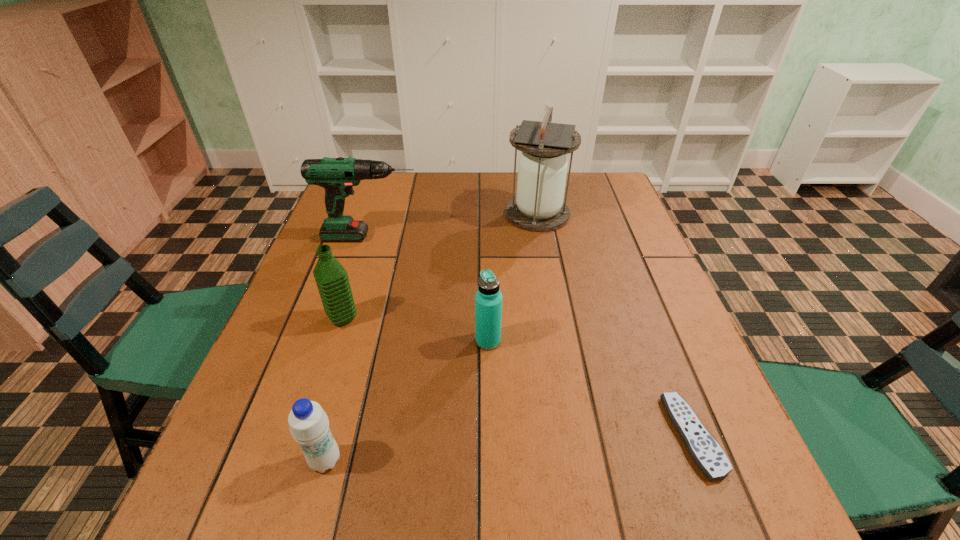
Where is `blank space located 0.190m on the handle side of the drill`? The width and height of the screenshot is (960, 540). blank space located 0.190m on the handle side of the drill is located at coordinates (489, 237).

Find the location of a particular element. free space located 0.360m on the front of the farthest water bottle is located at coordinates (284, 500).

Where is `vacant region located 0.100m on the front of the fourth farthest object`? Image resolution: width=960 pixels, height=540 pixels. vacant region located 0.100m on the front of the fourth farthest object is located at coordinates (489, 391).

Identify the location of vacant space situated 0.170m on the right of the nearest water bottle. The width and height of the screenshot is (960, 540). (442, 461).

This screenshot has height=540, width=960. What are the coordinates of `blank space located on the back of the shortest object` in the screenshot? It's located at (667, 370).

You are a GUI agent. You are given a task and a screenshot of the screen. Output one action in this format:
    pyautogui.click(x=<x>, y=<y>)
    Task: Click on the object that is at the far edge
    This screenshot has width=960, height=540.
    Given the screenshot: What is the action you would take?
    (538, 206)

You are a GUI agent. You are given a task and a screenshot of the screen. Output one action in this format:
    pyautogui.click(x=<x>, y=<y>)
    Task: Click on the drill at the left edge
    The width and height of the screenshot is (960, 540).
    Given the screenshot: What is the action you would take?
    pyautogui.click(x=337, y=176)

Where is `object present at the right edge`? This screenshot has height=540, width=960. object present at the right edge is located at coordinates (707, 454).

Locate an element on the screen. The image size is (960, 540). vacant space at the far edge of the desktop is located at coordinates (471, 211).

Identify the location of blank space at the left edge of the desktop. The height and width of the screenshot is (540, 960). (220, 472).